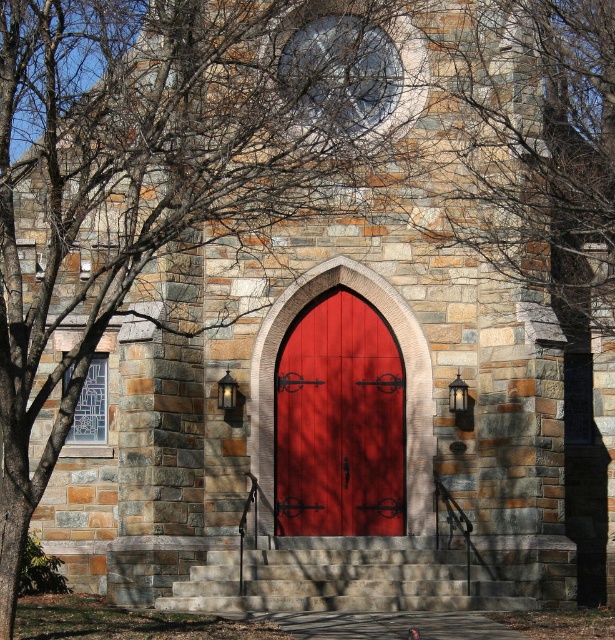
You are standing at the entrance of the church and want to locate the door. Based on the scene, which direction should you move relative to the stone steps at center to find the matte wood door at center?

The matte wood door at center is to the left of the stone steps at center. So, you should move to the left side of the stone steps at center to locate the door.

You are an architect designing a new building and want to replicate the door and steps from the image. If you have a limited amount of wood, which object should you prioritize creating first, the matte wood door at center or the stone steps at center?

The matte wood door at center is thinner than the stone steps at center, so you should prioritize creating the matte wood door at center first since it requires less wood material.